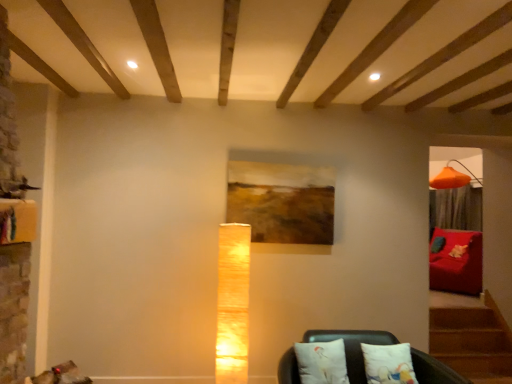
This screenshot has width=512, height=384. Find the location of `white fabric pillow at lower center, positioned as the first pillow in left-to-right order`. white fabric pillow at lower center, positioned as the first pillow in left-to-right order is located at coordinates (322, 362).

What is the approximate width of white fabric pillow at lower center, positioned as the first pillow in left-to-right order?

The width of white fabric pillow at lower center, positioned as the first pillow in left-to-right order, is 12.46 centimeters.

At what (x,y) coordinates should I click in order to perform the action: click on velvet red sofa at right, which ranks as the first furniture in back-to-front order. Please return your answer as a coordinate pair (x, y). The width and height of the screenshot is (512, 384). Looking at the image, I should click on (456, 261).

What do you see at coordinates (456, 261) in the screenshot?
I see `velvet red sofa at right, which is counted as the first furniture, starting from the right` at bounding box center [456, 261].

Where is `matte textured lamp at center`? The width and height of the screenshot is (512, 384). matte textured lamp at center is located at coordinates (233, 303).

Is the depth of matte textured lamp at center less than that of velvet red sofa at right, which ranks as the first furniture in back-to-front order?

Yes, it is in front of velvet red sofa at right, which ranks as the first furniture in back-to-front order.

Which furniture is the 2nd one when counting from the right side of the matte textured lamp at center? Please provide its 2D coordinates.

[(456, 261)]

From the picture: Can you tell me how much wooden painting at center and matte textured lamp at center differ in facing direction?

2.05 degrees.

Is the surface of wooden painting at center in direct contact with matte textured lamp at center?

No, wooden painting at center is not beside matte textured lamp at center.

Can you confirm if wooden painting at center is taller than matte textured lamp at center?

In fact, wooden painting at center may be shorter than matte textured lamp at center.

Is wooden painting at center located outside matte textured lamp at center?

Yes, wooden painting at center is not within matte textured lamp at center.

In the scene shown: Is wooden painting at center smaller than velvet red sofa at right, which is counted as the first furniture, starting from the right?

Indeed, wooden painting at center has a smaller size compared to velvet red sofa at right, which is counted as the first furniture, starting from the right.

From the picture: Does wooden painting at center come in front of velvet red sofa at right, marked as the 2th furniture in a left-to-right arrangement?

Yes, wooden painting at center is in front of velvet red sofa at right, marked as the 2th furniture in a left-to-right arrangement.

Considering the positions of objects wooden painting at center and velvet red sofa at right, which is counted as the first furniture, starting from the right, in the image provided, who is more to the left, wooden painting at center or velvet red sofa at right, which is counted as the first furniture, starting from the right,?

wooden painting at center is more to the left.

Does wooden painting at center come in front of white cotton pillow at lower center, the first pillow when ordered from right to left?

That is False.

Is wooden painting at center next to white cotton pillow at lower center, the 2th pillow from the left?

wooden painting at center is not next to white cotton pillow at lower center, the 2th pillow from the left, and they're not touching.

Is white cotton pillow at lower center, the first pillow when ordered from right to left, at the back of wooden painting at center?

wooden painting at center does not have its back to white cotton pillow at lower center, the first pillow when ordered from right to left.

Locate an element on the screen. The height and width of the screenshot is (384, 512). the 2nd pillow to the right of the wooden painting at center, starting your count from the anchor is located at coordinates click(x=388, y=364).

Is velvet red sofa at right, which ranks as the first furniture in back-to-front order, far away from wooden painting at center?

velvet red sofa at right, which ranks as the first furniture in back-to-front order, is far away from wooden painting at center.

From a real-world perspective, is velvet red sofa at right, which ranks as the first furniture in back-to-front order, below wooden painting at center?

Yes, from a real-world perspective, velvet red sofa at right, which ranks as the first furniture in back-to-front order, is below wooden painting at center.

Is point (430, 246) positioned in front of point (287, 168)?

No, (430, 246) is behind (287, 168).

At what (x,y) coordinates should I click in order to perform the action: click on picture frame above the velvet red sofa at right, the second furniture in the front-to-back sequence (from the image's perspective). Please return your answer as a coordinate pair (x, y). The width and height of the screenshot is (512, 384). Looking at the image, I should click on (282, 202).

Who is bigger, white fabric cushions at lower center, marked as the first furniture in a front-to-back arrangement, or wooden painting at center?

Bigger between the two is white fabric cushions at lower center, marked as the first furniture in a front-to-back arrangement.

Which of these two, white fabric cushions at lower center, marked as the first furniture in a front-to-back arrangement, or wooden painting at center, is thinner?

wooden painting at center.

Is white fabric cushions at lower center, marked as the first furniture in a front-to-back arrangement, aimed at wooden painting at center?

No, white fabric cushions at lower center, marked as the first furniture in a front-to-back arrangement, is not facing towards wooden painting at center.

Between white fabric pillow at lower center, positioned as the first pillow in left-to-right order, and white cotton pillow at lower center, the 2th pillow from the left, which one is positioned in front?

white fabric pillow at lower center, positioned as the first pillow in left-to-right order, is more forward.

In the scene shown: Is white fabric pillow at lower center, positioned as the first pillow in left-to-right order, touching white cotton pillow at lower center, the 2th pillow from the left?

white fabric pillow at lower center, positioned as the first pillow in left-to-right order, and white cotton pillow at lower center, the 2th pillow from the left, are clearly separated.

Is white fabric pillow at lower center, positioned as the first pillow in left-to-right order, inside or outside of white cotton pillow at lower center, the 2th pillow from the left?

white fabric pillow at lower center, positioned as the first pillow in left-to-right order, cannot be found inside white cotton pillow at lower center, the 2th pillow from the left.

Image resolution: width=512 pixels, height=384 pixels. I want to click on furniture that appears behind the matte textured lamp at center, so pyautogui.click(x=456, y=261).

Find the location of a particular element. picture frame located above the matte textured lamp at center (from the image's perspective) is located at coordinates (282, 202).

Consider the image. Considering their positions, is white cotton pillow at lower center, the 2th pillow from the left, positioned closer to wooden painting at center than velvet red sofa at right, marked as the 2th furniture in a left-to-right arrangement?

Among the two, white cotton pillow at lower center, the 2th pillow from the left, is located nearer to wooden painting at center.

Considering their positions, is white cotton pillow at lower center, the first pillow when ordered from right to left, positioned closer to velvet red sofa at right, which ranks as the first furniture in back-to-front order, than white fabric pillow at lower center, positioned as the first pillow in left-to-right order?

Based on the image, white cotton pillow at lower center, the first pillow when ordered from right to left, appears to be nearer to velvet red sofa at right, which ranks as the first furniture in back-to-front order.

Based on their spatial positions, is white fabric cushions at lower center, the second furniture when ordered from back to front, or white cotton pillow at lower center, the first pillow when ordered from right to left, further from matte textured lamp at center?

The object further to matte textured lamp at center is white cotton pillow at lower center, the first pillow when ordered from right to left.

Looking at the image, which one is located closer to wooden painting at center, white cotton pillow at lower center, the first pillow when ordered from right to left, or white fabric cushions at lower center, marked as the first furniture in a front-to-back arrangement?

The object closer to wooden painting at center is white fabric cushions at lower center, marked as the first furniture in a front-to-back arrangement.

From the picture: When comparing their distances from white fabric cushions at lower center, the second furniture when ordered from back to front, does matte textured lamp at center or white fabric pillow at lower center, positioned as the first pillow in left-to-right order, seem further?

The object further to white fabric cushions at lower center, the second furniture when ordered from back to front, is matte textured lamp at center.

Based on their spatial positions, is white fabric pillow at lower center, which is the second pillow in right-to-left order, or white fabric cushions at lower center, the second furniture when ordered from back to front, further from white cotton pillow at lower center, the 2th pillow from the left?

white fabric pillow at lower center, which is the second pillow in right-to-left order.

Looking at the image, which one is located further to velvet red sofa at right, which ranks as the first furniture in back-to-front order, wooden painting at center or white fabric pillow at lower center, which is the second pillow in right-to-left order?

Among the two, white fabric pillow at lower center, which is the second pillow in right-to-left order, is located further to velvet red sofa at right, which ranks as the first furniture in back-to-front order.

Looking at this image, when comparing their distances from matte textured lamp at center, does white fabric pillow at lower center, positioned as the first pillow in left-to-right order, or velvet red sofa at right, marked as the 2th furniture in a left-to-right arrangement, seem closer?

white fabric pillow at lower center, positioned as the first pillow in left-to-right order.

Identify the location of pillow between wooden painting at center and white cotton pillow at lower center, the first pillow when ordered from right to left, vertically. (322, 362).

At what (x,y) coordinates should I click in order to perform the action: click on pillow between matte textured lamp at center and white fabric cushions at lower center, marked as the first furniture in a front-to-back arrangement, from left to right. Please return your answer as a coordinate pair (x, y). Looking at the image, I should click on (322, 362).

Where is `picture frame between matte textured lamp at center and velvet red sofa at right, marked as the 2th furniture in a left-to-right arrangement, in the horizontal direction`? picture frame between matte textured lamp at center and velvet red sofa at right, marked as the 2th furniture in a left-to-right arrangement, in the horizontal direction is located at coordinates (282, 202).

At what (x,y) coordinates should I click in order to perform the action: click on lamp that lies between wooden painting at center and white fabric pillow at lower center, which is the second pillow in right-to-left order, from top to bottom. Please return your answer as a coordinate pair (x, y). Looking at the image, I should click on (233, 303).